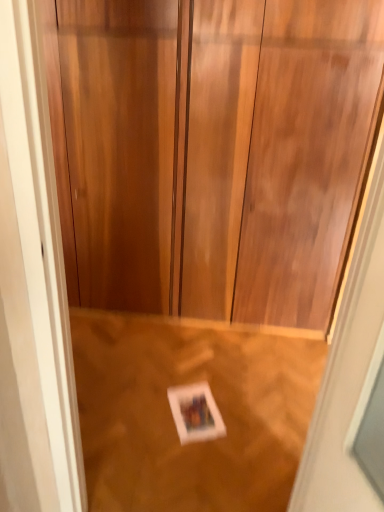
The image size is (384, 512). Find the location of `free location in front of white paper at center`. free location in front of white paper at center is located at coordinates (190, 451).